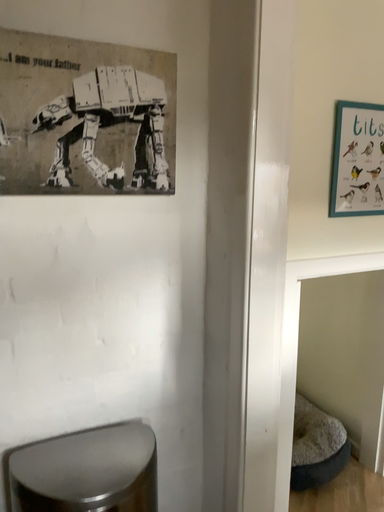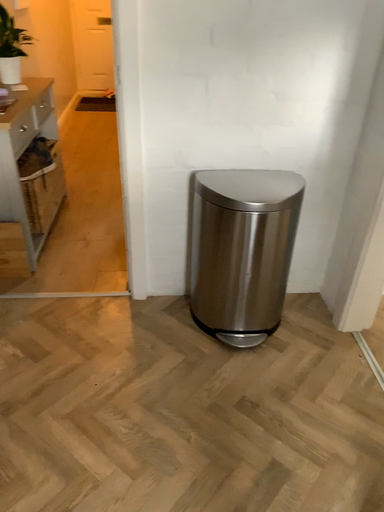
Question: Which way did the camera rotate in the video?

Choices:
 (A) rotated right
 (B) rotated left

Answer: (B)